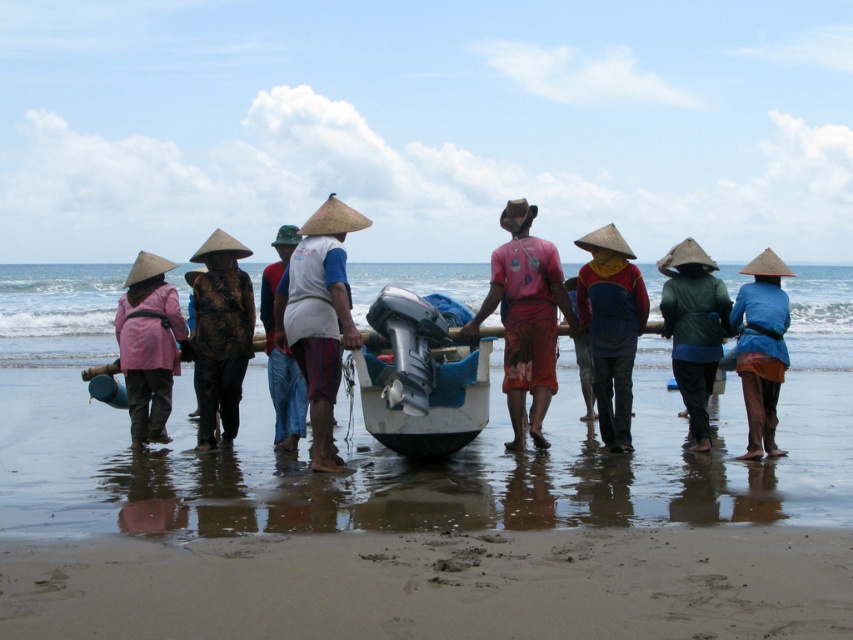
Does clear blue water at center appear under matte pink jacket at left?

No.

Can you confirm if clear blue water at center is taller than matte pink jacket at left?

Indeed, clear blue water at center has a greater height compared to matte pink jacket at left.

Between point (640, 349) and point (167, 352), which one is positioned in front?

Point (167, 352) is more forward.

This screenshot has height=640, width=853. What are the coordinates of `clear blue water at center` in the screenshot? It's located at (57, 314).

Is white cotton shirt at center closer to the viewer compared to white fabric shirt at center?

Yes, it is in front of white fabric shirt at center.

Who is positioned more to the right, white cotton shirt at center or white fabric shirt at center?

From the viewer's perspective, white cotton shirt at center appears more on the right side.

You are a GUI agent. You are given a task and a screenshot of the screen. Output one action in this format:
    pyautogui.click(x=<x>, y=<y>)
    Task: Click on the white cotton shirt at center
    
    Given the screenshot: What is the action you would take?
    pyautogui.click(x=318, y=317)

Is textured brown jacket at center below white fabric shirt at center?

Incorrect, textured brown jacket at center is not positioned below white fabric shirt at center.

Which of these two, textured brown jacket at center or white fabric shirt at center, stands shorter?

textured brown jacket at center is shorter.

Measure the distance between point (200, 244) and camera.

Point (200, 244) and camera are 95.43 meters apart from each other.

Where is `textured brown jacket at center`? The width and height of the screenshot is (853, 640). textured brown jacket at center is located at coordinates (219, 333).